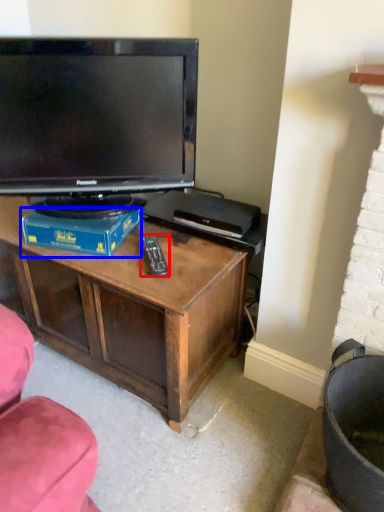
Question: Which object appears farthest to the camera in this image, remote (highlighted by a red box) or book (highlighted by a blue box)?

Choices:
 (A) remote
 (B) book

Answer: (B)